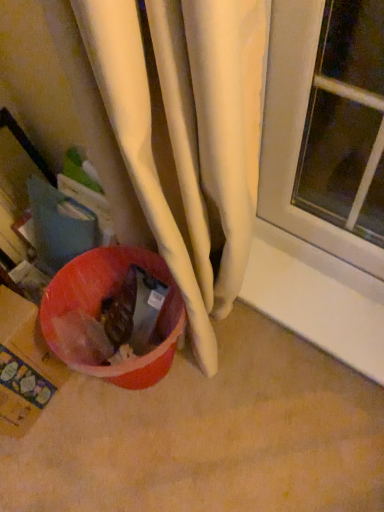
Locate an element on the screen. cardboard box at lower left is located at coordinates tap(24, 366).

What do you see at coordinates (24, 366) in the screenshot? I see `cardboard box at lower left` at bounding box center [24, 366].

Measure the distance between point (62, 383) and camera.

Point (62, 383) is 3.53 feet from camera.

This screenshot has height=512, width=384. In order to click on cardboard box at lower left in this screenshot , I will do `click(24, 366)`.